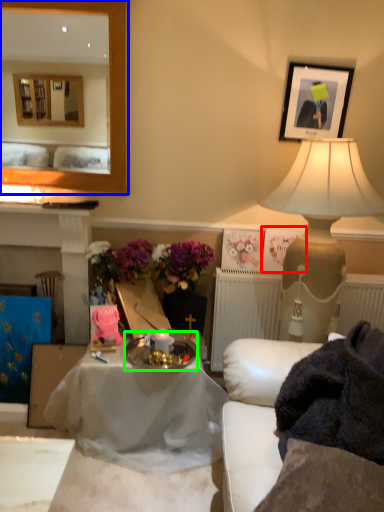
Question: Which object is positioned farthest from picture frame (highlighted by a red box)? Select from mirror (highlighted by a blue box) and round table (highlighted by a green box).

Choices:
 (A) mirror
 (B) round table

Answer: (A)